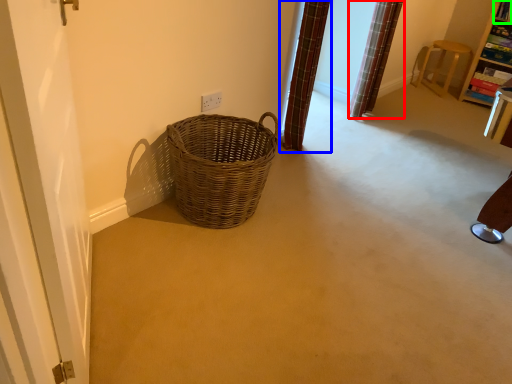
Question: Considering the real-world distances, which object is farthest from curtain (highlighted by a red box)? curtain (highlighted by a blue box) or shelf (highlighted by a green box)?

Choices:
 (A) curtain
 (B) shelf

Answer: (B)